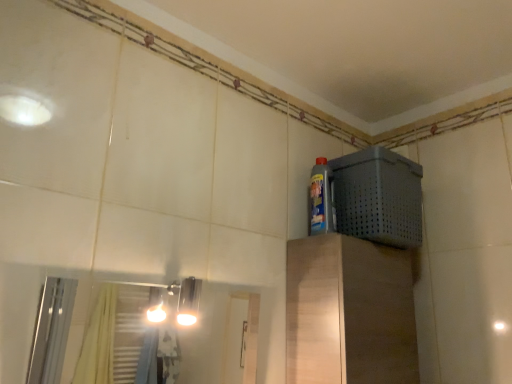
This screenshot has width=512, height=384. I want to click on gray perforated basket at upper right, so click(378, 197).

Describe the element at coordinates (378, 197) in the screenshot. I see `gray perforated basket at upper right` at that location.

In order to face gray perforated basket at upper right, should I rotate leftwards or rightwards?

Turn right by 16.546 degrees to look at gray perforated basket at upper right.

Find the location of `blue glossy bottle at upper right`. blue glossy bottle at upper right is located at coordinates (321, 199).

What do you see at coordinates (321, 199) in the screenshot? I see `blue glossy bottle at upper right` at bounding box center [321, 199].

Identify the location of gray perforated basket at upper right. The image size is (512, 384). (378, 197).

Based on their positions, is gray perforated basket at upper right located to the left or right of blue glossy bottle at upper right?

In the image, gray perforated basket at upper right appears on the right side of blue glossy bottle at upper right.

Is gray perforated basket at upper right positioned before blue glossy bottle at upper right?

Yes, gray perforated basket at upper right is closer to the viewer.

Which point is more distant from viewer, (412,195) or (332,202)?

The point (412,195) is farther.

From the image's perspective, is gray perforated basket at upper right above or below blue glossy bottle at upper right?

Clearly, from the image's perspective, gray perforated basket at upper right is below blue glossy bottle at upper right.

From a real-world perspective, is gray perforated basket at upper right on top of blue glossy bottle at upper right?

No, from a real-world perspective, gray perforated basket at upper right is not over blue glossy bottle at upper right

Considering the sizes of gray perforated basket at upper right and blue glossy bottle at upper right in the image, is gray perforated basket at upper right wider or thinner than blue glossy bottle at upper right?

Considering their sizes, gray perforated basket at upper right looks broader than blue glossy bottle at upper right.

Considering the sizes of gray perforated basket at upper right and blue glossy bottle at upper right in the image, is gray perforated basket at upper right taller or shorter than blue glossy bottle at upper right?

In the image, gray perforated basket at upper right appears to be taller than blue glossy bottle at upper right.

Between gray perforated basket at upper right and blue glossy bottle at upper right, which one has smaller size?

Smaller between the two is blue glossy bottle at upper right.

Do you think gray perforated basket at upper right is within blue glossy bottle at upper right, or outside of it?

gray perforated basket at upper right is not inside blue glossy bottle at upper right, it's outside.

Are gray perforated basket at upper right and blue glossy bottle at upper right far apart?

No, gray perforated basket at upper right is not far from blue glossy bottle at upper right.

Could you tell me if gray perforated basket at upper right is turned towards blue glossy bottle at upper right?

No.

Can you tell me how much gray perforated basket at upper right and blue glossy bottle at upper right differ in facing direction?

They differ by 0.0032 degrees in their facing directions.

The height and width of the screenshot is (384, 512). What are the coordinates of `bottle above the gray perforated basket at upper right (from the image's perspective)` in the screenshot? It's located at (321, 199).

Is blue glossy bottle at upper right to the right of gray perforated basket at upper right from the viewer's perspective?

No, blue glossy bottle at upper right is not to the right of gray perforated basket at upper right.

In the image, is blue glossy bottle at upper right positioned in front of or behind gray perforated basket at upper right?

In the image, blue glossy bottle at upper right appears behind gray perforated basket at upper right.

Considering the positions of points (319, 200) and (384, 150), is point (319, 200) closer to camera compared to point (384, 150)?

That is False.

From the image's perspective, is blue glossy bottle at upper right above or below gray perforated basket at upper right?

blue glossy bottle at upper right is situated higher than gray perforated basket at upper right in the image.

From a real-world perspective, which object rests below the other?

gray perforated basket at upper right, from a real-world perspective.

Considering the sizes of objects blue glossy bottle at upper right and gray perforated basket at upper right in the image provided, who is thinner, blue glossy bottle at upper right or gray perforated basket at upper right?

blue glossy bottle at upper right is thinner.

Who is taller, blue glossy bottle at upper right or gray perforated basket at upper right?

Standing taller between the two is gray perforated basket at upper right.

Does blue glossy bottle at upper right have a smaller size compared to gray perforated basket at upper right?

Yes, blue glossy bottle at upper right is smaller than gray perforated basket at upper right.

Is blue glossy bottle at upper right surrounding gray perforated basket at upper right?

No, blue glossy bottle at upper right does not contain gray perforated basket at upper right.

Is blue glossy bottle at upper right not near gray perforated basket at upper right?

blue glossy bottle at upper right is near gray perforated basket at upper right, not far away.

Is blue glossy bottle at upper right positioned with its back to gray perforated basket at upper right?

No, gray perforated basket at upper right is not at the back of blue glossy bottle at upper right.

Can you tell me how much blue glossy bottle at upper right and gray perforated basket at upper right differ in facing direction?

0.0032 degrees.

Locate an element on the screen. The image size is (512, 384). bottle above the gray perforated basket at upper right (from the image's perspective) is located at coordinates (321, 199).

At what (x,y) coordinates should I click in order to perform the action: click on bottle above the gray perforated basket at upper right (from a real-world perspective). Please return your answer as a coordinate pair (x, y). This screenshot has width=512, height=384. Looking at the image, I should click on (321, 199).

You are a GUI agent. You are given a task and a screenshot of the screen. Output one action in this format:
    pyautogui.click(x=<x>, y=<y>)
    Task: Click on the bottle behind the gray perforated basket at upper right
    This screenshot has width=512, height=384.
    Given the screenshot: What is the action you would take?
    pyautogui.click(x=321, y=199)